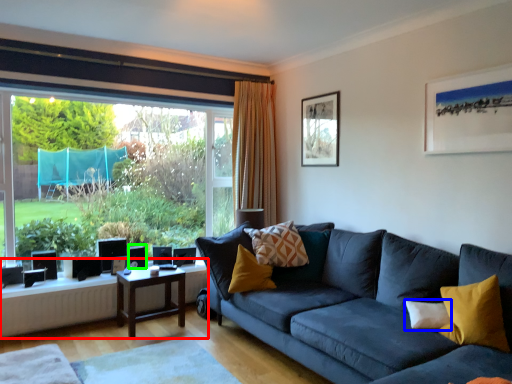
Question: Based on their relative distances, which object is farther from table (highlighted by a red box)? Choose from pillow (highlighted by a blue box) and speaker (highlighted by a green box).

Choices:
 (A) pillow
 (B) speaker

Answer: (A)